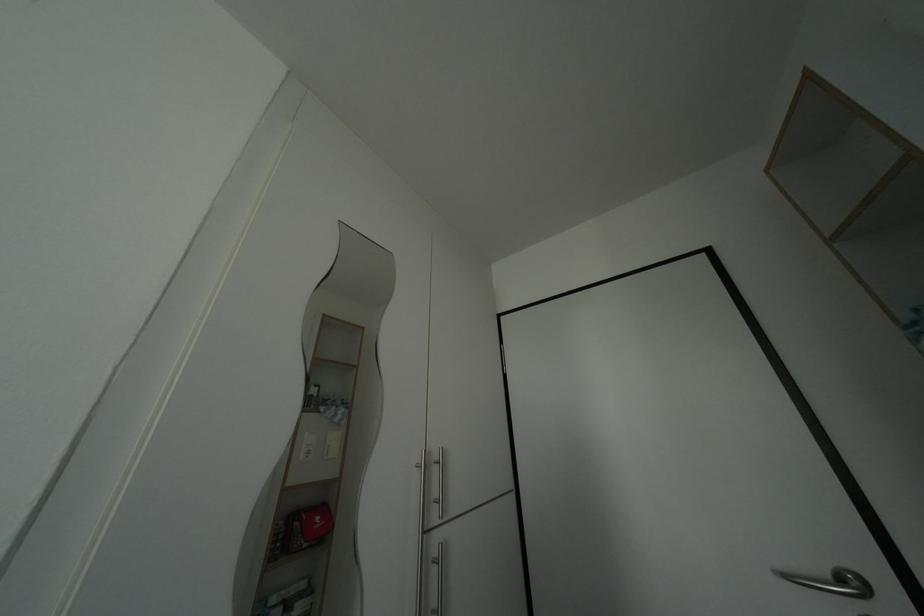
Describe the element at coordinates (864, 614) in the screenshot. I see `a metal door handle` at that location.